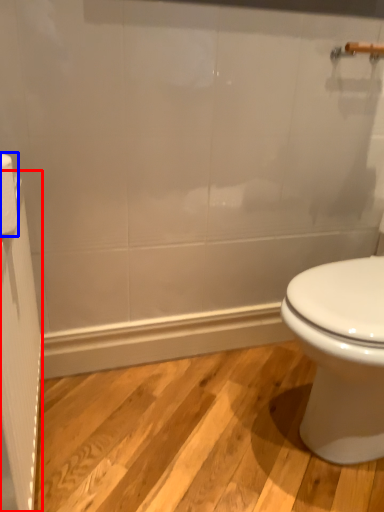
Question: Among these objects, which one is nearest to the camera, screen door (highlighted by a red box) or toilet paper (highlighted by a blue box)?

Choices:
 (A) screen door
 (B) toilet paper

Answer: (A)